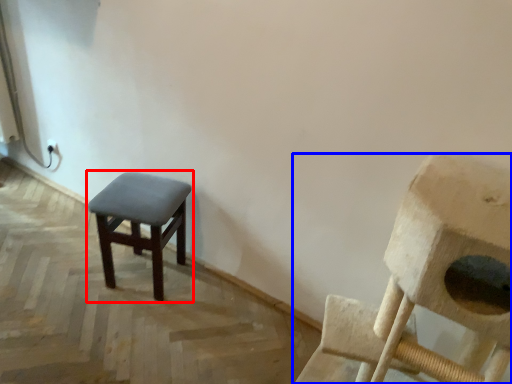
Question: Among these objects, which one is nearest to the camera, stool (highlighted by a red box) or chair (highlighted by a blue box)?

Choices:
 (A) stool
 (B) chair

Answer: (B)